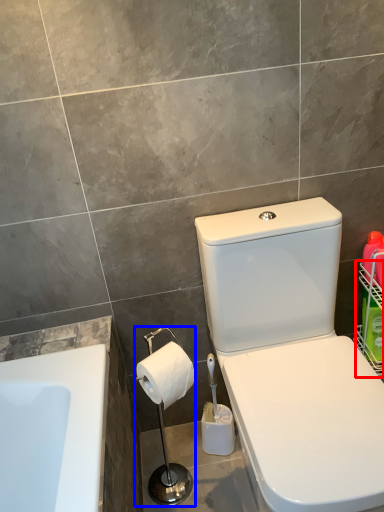
Question: Which object is further to the camera taking this photo, basket (highlighted by a red box) or shower (highlighted by a blue box)?

Choices:
 (A) basket
 (B) shower

Answer: (A)